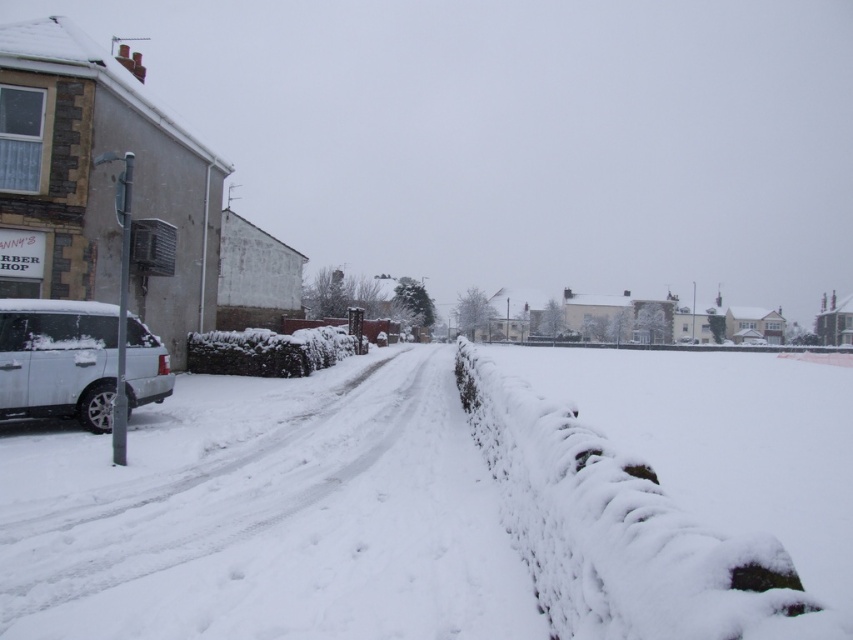
Question: Is white fluffy snow at center positioned behind sleek silver suv at left?

Choices:
 (A) no
 (B) yes

Answer: (A)

Question: Where is white fluffy snow at center located in relation to sleek silver suv at left in the image?

Choices:
 (A) above
 (B) below

Answer: (B)

Question: Among these points, which one is farthest from the camera?

Choices:
 (A) (96, 307)
 (B) (740, 452)

Answer: (A)

Question: Does white fluffy snow at center have a greater width compared to sleek silver suv at left?

Choices:
 (A) yes
 (B) no

Answer: (A)

Question: Which of the following is the closest to the observer?

Choices:
 (A) (83, 364)
 (B) (238, 394)

Answer: (A)